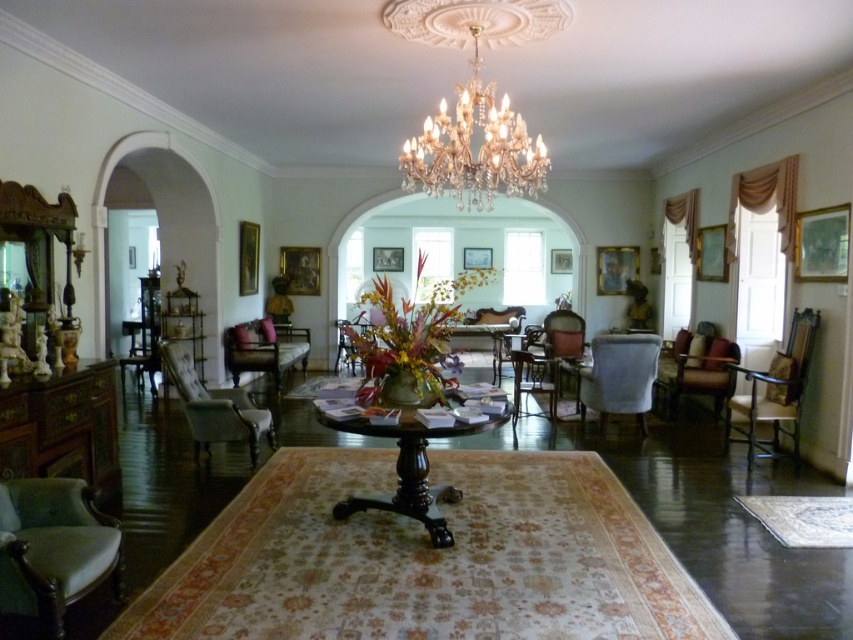
Question: Is shiny dark wood table at center positioned behind wooden chair at center?

Choices:
 (A) yes
 (B) no

Answer: (B)

Question: Considering the real-world distances, which object is farthest from the shiny dark wood table at center?

Choices:
 (A) gold crystal chandelier at upper center
 (B) velvet green armchair at lower left
 (C) velvet blue armchair at center
 (D) velvet upholstered armchair at center

Answer: (D)

Question: Which of these objects is positioned farthest from the leather armchair at right?

Choices:
 (A) wooden chair at center
 (B) velvet upholstered armchair at center-left

Answer: (B)

Question: Is velvet upholstered armchair at center-left above wooden chair at center?

Choices:
 (A) yes
 (B) no

Answer: (B)

Question: Which object is farther from the camera taking this photo?

Choices:
 (A) velvet upholstered armchair at center
 (B) gold crystal chandelier at upper center

Answer: (A)

Question: Is gold crystal chandelier at upper center smaller than leather armchair at right?

Choices:
 (A) no
 (B) yes

Answer: (B)